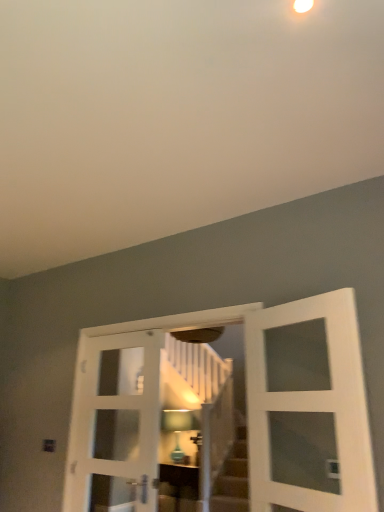
Locate an element on the screen. matte glass lampshade at center is located at coordinates (177, 432).

Where is `white wooden door at center, positioned as the second door in left-to-right order`? This screenshot has height=512, width=384. white wooden door at center, positioned as the second door in left-to-right order is located at coordinates (227, 408).

The width and height of the screenshot is (384, 512). Describe the element at coordinates (178, 488) in the screenshot. I see `matte brown cabinet at center` at that location.

I want to click on matte glass lampshade at center, so click(x=177, y=432).

Would you say matte glass lampshade at center is to the left or to the right of white wooden door at center, which is counted as the second door, starting from the right, in the picture?

In the image, matte glass lampshade at center appears on the right side of white wooden door at center, which is counted as the second door, starting from the right.

Can you confirm if matte glass lampshade at center is shorter than white wooden door at center, which is counted as the second door, starting from the right?

Indeed, matte glass lampshade at center has a lesser height compared to white wooden door at center, which is counted as the second door, starting from the right.

Is white wooden door at center, which is counted as the second door, starting from the right, surrounded by matte glass lampshade at center?

No, white wooden door at center, which is counted as the second door, starting from the right, is not a part of matte glass lampshade at center.

Where is `door that is on the left side of white wooden door at center, which is counted as the second door, starting from the right`? The image size is (384, 512). door that is on the left side of white wooden door at center, which is counted as the second door, starting from the right is located at coordinates (115, 423).

Is white glass door at center, marked as the 3th door in a right-to-left arrangement, shorter than white wooden door at center, which is counted as the second door, starting from the right?

Correct, white glass door at center, marked as the 3th door in a right-to-left arrangement, is not as tall as white wooden door at center, which is counted as the second door, starting from the right.

From the picture: From the image's perspective, does white glass door at center, marked as the 3th door in a right-to-left arrangement, appear lower than white wooden door at center, which is counted as the second door, starting from the right?

Yes.

Which object is positioned more to the left, white glass door at center, marked as the 3th door in a right-to-left arrangement, or white wooden door at center, positioned as the second door in left-to-right order?

Positioned to the left is white glass door at center, marked as the 3th door in a right-to-left arrangement.

Relative to white glass door at center, which appears as the 1th door when viewed from the right, is matte brown cabinet at center in front or behind?

In the image, matte brown cabinet at center appears behind white glass door at center, which appears as the 1th door when viewed from the right.

Image resolution: width=384 pixels, height=512 pixels. I want to click on furniture on the left of white glass door at center, the 3th door from the left, so click(178, 488).

Considering the sizes of objects matte brown cabinet at center and white glass door at center, the 3th door from the left, in the image provided, who is thinner, matte brown cabinet at center or white glass door at center, the 3th door from the left,?

Thinner between the two is white glass door at center, the 3th door from the left.

Would you say matte brown cabinet at center is outside white glass door at center, the 3th door from the left?

Yes, matte brown cabinet at center is not within white glass door at center, the 3th door from the left.

What's the angular difference between matte glass lampshade at center and white glass door at center, which appears as the 1th door when viewed from the right,'s facing directions?

The angular difference between matte glass lampshade at center and white glass door at center, which appears as the 1th door when viewed from the right, is 23 degrees.

Considering the positions of point (165, 434) and point (275, 390), is point (165, 434) closer or farther from the camera than point (275, 390)?

Point (165, 434) is farther from the camera than point (275, 390).

Considering the sizes of matte glass lampshade at center and white glass door at center, which appears as the 1th door when viewed from the right, in the image, is matte glass lampshade at center taller or shorter than white glass door at center, which appears as the 1th door when viewed from the right,?

Clearly, matte glass lampshade at center is shorter compared to white glass door at center, which appears as the 1th door when viewed from the right.

Could white glass door at center, the 3th door from the left, be considered to be inside matte glass lampshade at center?

Definitely not — white glass door at center, the 3th door from the left, is not inside matte glass lampshade at center.

Identify the location of light fixture located behind the white glass door at center, which appears as the 1th door when viewed from the left. (177, 432).

From the picture: Is white glass door at center, marked as the 3th door in a right-to-left arrangement, aimed at matte glass lampshade at center?

No.

Is white glass door at center, which appears as the 1th door when viewed from the left, wider than matte glass lampshade at center?

No.

From a real-world perspective, which is physically below, white glass door at center, marked as the 3th door in a right-to-left arrangement, or matte glass lampshade at center?

In real-world perspective, matte glass lampshade at center is lower.

From the image's perspective, is white wooden door at center, which is counted as the second door, starting from the right, beneath white glass door at center, which appears as the 1th door when viewed from the right?

Indeed, from the image's perspective, white wooden door at center, which is counted as the second door, starting from the right, is shown beneath white glass door at center, which appears as the 1th door when viewed from the right.

Are white wooden door at center, positioned as the second door in left-to-right order, and white glass door at center, which appears as the 1th door when viewed from the right, far apart?

That's not correct — white wooden door at center, positioned as the second door in left-to-right order, is a little close to white glass door at center, which appears as the 1th door when viewed from the right.

Can you tell me how much white wooden door at center, positioned as the second door in left-to-right order, and white glass door at center, the 3th door from the left, differ in facing direction?

There is a 22.5-degree angle between the facing directions of white wooden door at center, positioned as the second door in left-to-right order, and white glass door at center, the 3th door from the left.

From a real-world perspective, is white wooden door at center, which is counted as the second door, starting from the right, positioned above or below white glass door at center, which appears as the 1th door when viewed from the right?

From a real-world perspective, white wooden door at center, which is counted as the second door, starting from the right, is physically below white glass door at center, which appears as the 1th door when viewed from the right.

Is matte brown cabinet at center surrounding matte glass lampshade at center?

That's incorrect, matte glass lampshade at center is not inside matte brown cabinet at center.

From the picture: Is matte brown cabinet at center facing towards matte glass lampshade at center?

No, matte brown cabinet at center is not facing towards matte glass lampshade at center.

Is matte brown cabinet at center taller or shorter than matte glass lampshade at center?

Considering their sizes, matte brown cabinet at center has less height than matte glass lampshade at center.

Is matte brown cabinet at center at the right side of matte glass lampshade at center?

Correct, you'll find matte brown cabinet at center to the right of matte glass lampshade at center.

Image resolution: width=384 pixels, height=512 pixels. In order to click on the 2nd door in front when counting from the matte glass lampshade at center in this screenshot , I will do `click(227, 408)`.

Image resolution: width=384 pixels, height=512 pixels. I want to click on door that appears below the white wooden door at center, which is counted as the second door, starting from the right (from a real-world perspective), so click(115, 423).

Consider the image. Based on their spatial positions, is white glass door at center, the 3th door from the left, or white wooden door at center, positioned as the second door in left-to-right order, further from matte brown cabinet at center?

white glass door at center, the 3th door from the left, is further to matte brown cabinet at center.

Which object lies nearer to the anchor point white wooden door at center, which is counted as the second door, starting from the right, matte glass lampshade at center or white glass door at center, which appears as the 1th door when viewed from the left?

white glass door at center, which appears as the 1th door when viewed from the left.

From the picture: Which object lies further to the anchor point matte brown cabinet at center, white glass door at center, marked as the 3th door in a right-to-left arrangement, or white glass door at center, which appears as the 1th door when viewed from the right?

white glass door at center, which appears as the 1th door when viewed from the right, is positioned further to the anchor matte brown cabinet at center.

Looking at this image, considering their positions, is white glass door at center, which appears as the 1th door when viewed from the left, positioned closer to matte glass lampshade at center than white wooden door at center, positioned as the second door in left-to-right order?

white glass door at center, which appears as the 1th door when viewed from the left, is closer to matte glass lampshade at center.

Considering their positions, is matte glass lampshade at center positioned closer to white wooden door at center, which is counted as the second door, starting from the right, than matte brown cabinet at center?

The object closer to white wooden door at center, which is counted as the second door, starting from the right, is matte glass lampshade at center.

When comparing their distances from white glass door at center, which appears as the 1th door when viewed from the right, does matte glass lampshade at center or white glass door at center, marked as the 3th door in a right-to-left arrangement, seem closer?

white glass door at center, marked as the 3th door in a right-to-left arrangement, lies closer to white glass door at center, which appears as the 1th door when viewed from the right, than the other object.

When comparing their distances from matte glass lampshade at center, does white wooden door at center, which is counted as the second door, starting from the right, or white glass door at center, the 3th door from the left, seem closer?

white wooden door at center, which is counted as the second door, starting from the right.

From the image, which object appears to be nearer to matte glass lampshade at center, white glass door at center, marked as the 3th door in a right-to-left arrangement, or matte brown cabinet at center?

matte brown cabinet at center is closer to matte glass lampshade at center.

I want to click on door between white wooden door at center, which is counted as the second door, starting from the right, and matte brown cabinet at center, along the z-axis, so click(x=115, y=423).

The width and height of the screenshot is (384, 512). I want to click on furniture positioned between white wooden door at center, which is counted as the second door, starting from the right, and matte glass lampshade at center from near to far, so click(178, 488).

Identify the location of furniture between white glass door at center, marked as the 3th door in a right-to-left arrangement, and matte glass lampshade at center from front to back. (178, 488).

The height and width of the screenshot is (512, 384). What are the coordinates of `door between white wooden door at center, which is counted as the second door, starting from the right, and matte glass lampshade at center from front to back` in the screenshot? It's located at (115, 423).